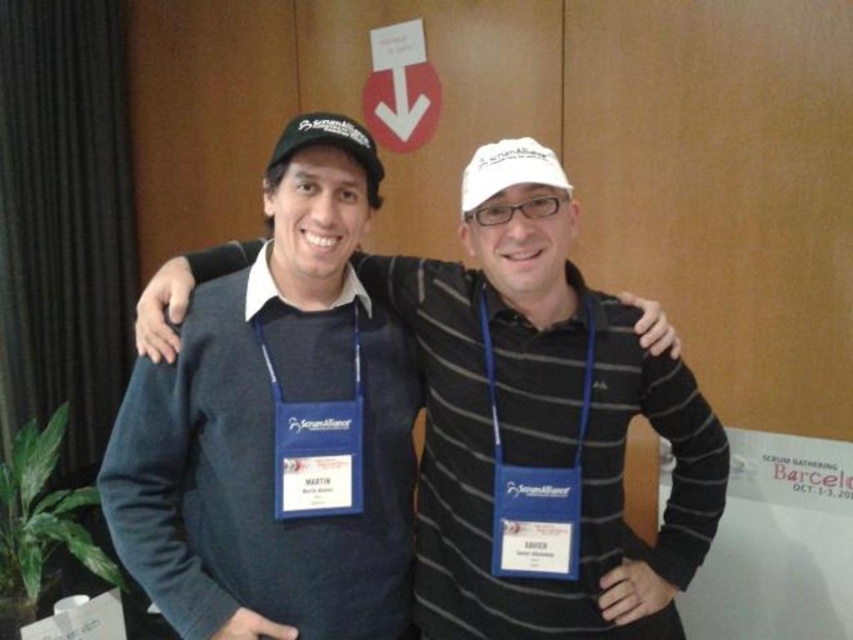
You are standing in front of the wooden panel wall with the red circular sign. You want to place a small sticker exactly halfway between the two points marked as point (592, 534) and point (378, 161). Which direction should you move from the closer point to reach the midpoint?

The midpoint between point (592, 534) and point (378, 161) would require moving towards the direction where both coordinates average. However, since point (592, 534) is closer to the viewer, the sticker should be placed between them, but the exact direction depends on their spatial arrangement. However, based on the given coordinates, the midpoint is calculated by averaging the x and y values. The closer point is point (378, 161) since it has a smaller y value, but according to the description, the

You are at a conference and want to take a photo of the dark blue sweater at center and the black matte baseball cap at upper center. Which object should you focus on first to ensure both are in frame?

You should focus on the black matte baseball cap at upper center first because the dark blue sweater at center is below it, so adjusting the camera angle to include the cap will naturally include the sweater below.

Where is the dark blue sweater at center located in the image?

The dark blue sweater at center is located at point (541, 428).